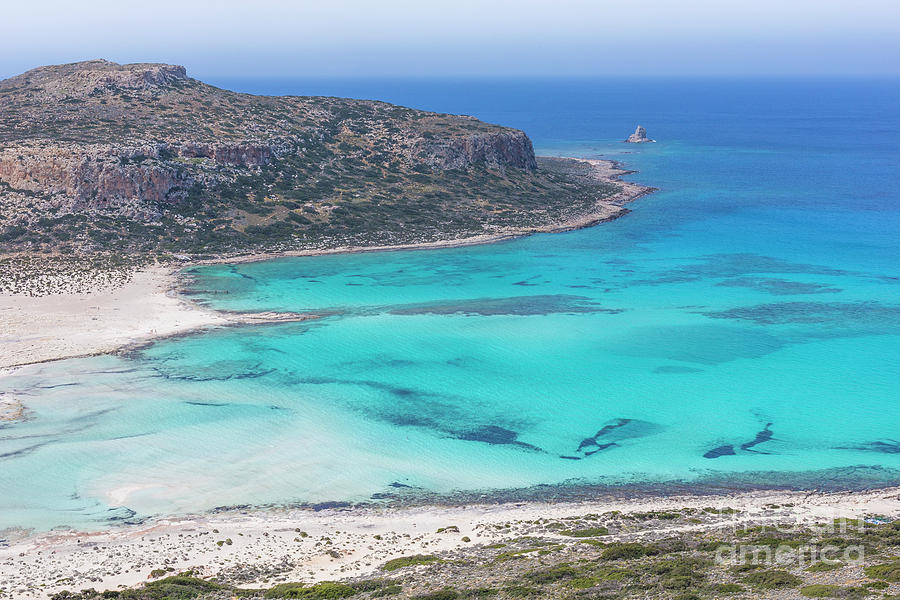
Where is `green plants`? green plants is located at coordinates (331, 590).